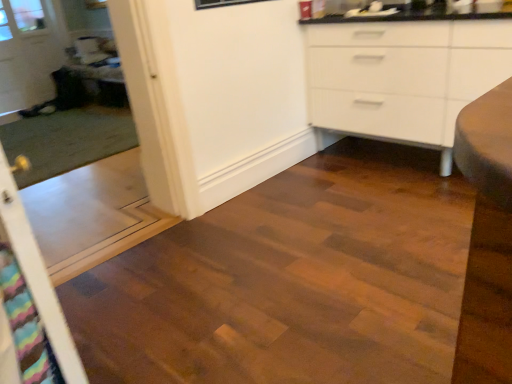
Where is `vacant area on the back side of transparent plastic screen door at left, which appears as the 1th screen door when viewed from the back`? The width and height of the screenshot is (512, 384). vacant area on the back side of transparent plastic screen door at left, which appears as the 1th screen door when viewed from the back is located at coordinates (108, 189).